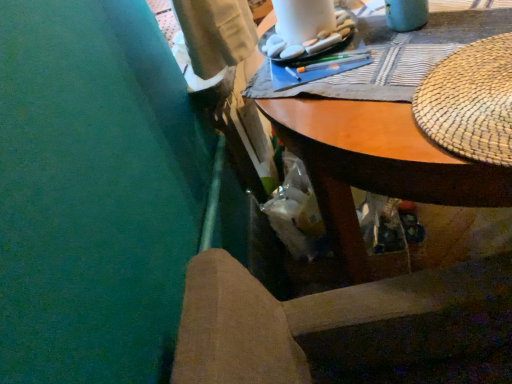
Question: Is wooden desk at upper center surrounded by woven straw placemat at upper right?

Choices:
 (A) no
 (B) yes

Answer: (A)

Question: Considering the relative positions of woven straw placemat at upper right and wooden desk at upper center in the image provided, is woven straw placemat at upper right to the right of wooden desk at upper center from the viewer's perspective?

Choices:
 (A) no
 (B) yes

Answer: (A)

Question: Is woven straw placemat at upper right not close to wooden desk at upper center?

Choices:
 (A) yes
 (B) no

Answer: (B)

Question: Can you confirm if woven straw placemat at upper right is bigger than wooden desk at upper center?

Choices:
 (A) yes
 (B) no

Answer: (B)

Question: Does woven straw placemat at upper right lie behind wooden desk at upper center?

Choices:
 (A) yes
 (B) no

Answer: (A)

Question: Visually, is white matte rocks at upper center positioned to the left or to the right of wooden chair at lower center?

Choices:
 (A) right
 (B) left

Answer: (B)

Question: Considering the positions of white matte rocks at upper center and wooden chair at lower center in the image, is white matte rocks at upper center wider or thinner than wooden chair at lower center?

Choices:
 (A) wide
 (B) thin

Answer: (B)

Question: Is white matte rocks at upper center spatially inside wooden chair at lower center, or outside of it?

Choices:
 (A) inside
 (B) outside

Answer: (B)

Question: From their relative heights in the image, would you say white matte rocks at upper center is taller or shorter than wooden chair at lower center?

Choices:
 (A) short
 (B) tall

Answer: (A)

Question: From a real-world perspective, relative to woven straw placemat at upper right, is white matte rocks at upper center vertically above or below?

Choices:
 (A) below
 (B) above

Answer: (B)

Question: Is white matte rocks at upper center in front of or behind woven straw placemat at upper right in the image?

Choices:
 (A) behind
 (B) front

Answer: (A)

Question: In terms of height, does white matte rocks at upper center look taller or shorter compared to woven straw placemat at upper right?

Choices:
 (A) short
 (B) tall

Answer: (B)

Question: From the image's perspective, is white matte rocks at upper center located above or below woven straw placemat at upper right?

Choices:
 (A) below
 (B) above

Answer: (B)

Question: Is point (431, 117) closer or farther from the camera than point (343, 18)?

Choices:
 (A) closer
 (B) farther

Answer: (A)

Question: In the image, is woven straw placemat at upper right positioned in front of or behind white matte rocks at upper center?

Choices:
 (A) behind
 (B) front

Answer: (B)